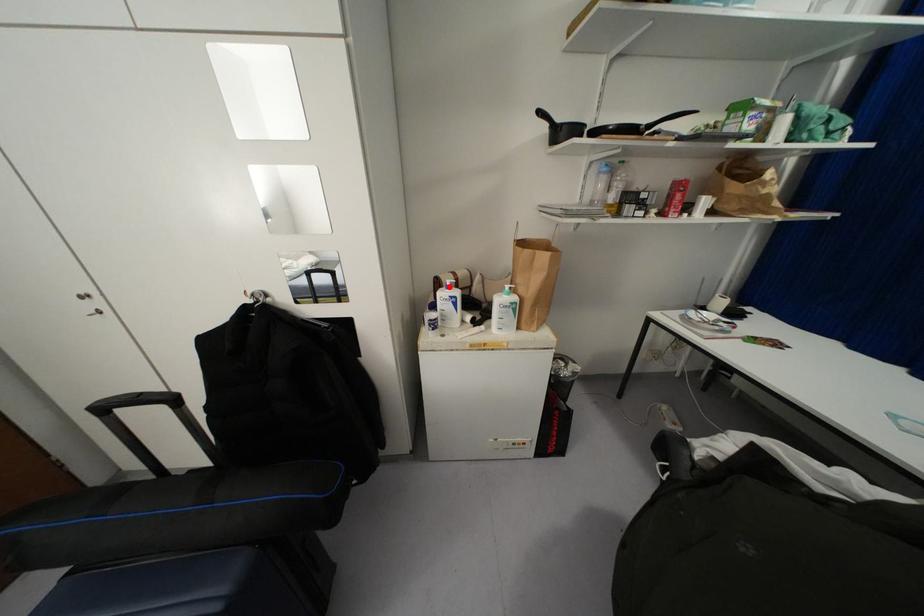
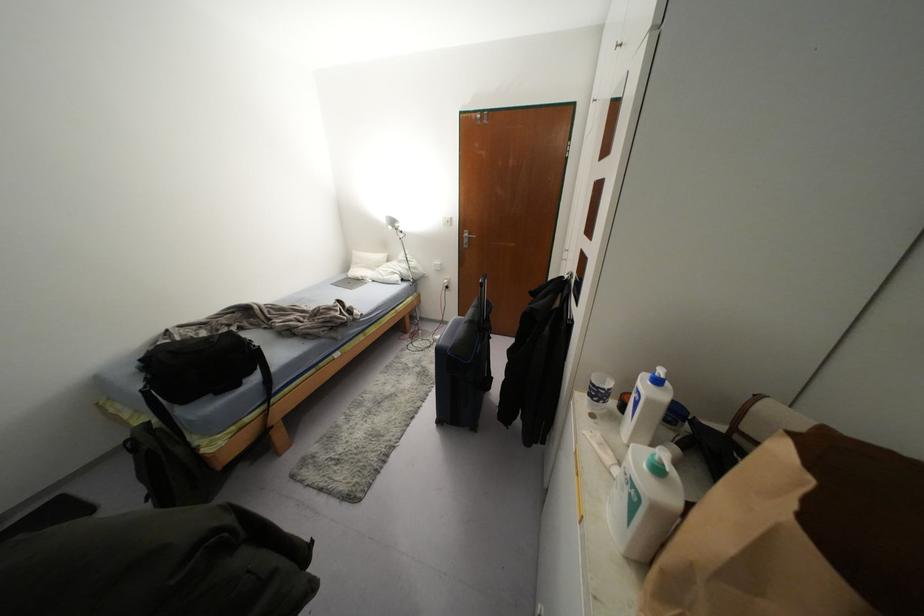
Find the pixel in the second image that matches the highlighted location in the first image.

(658, 381)